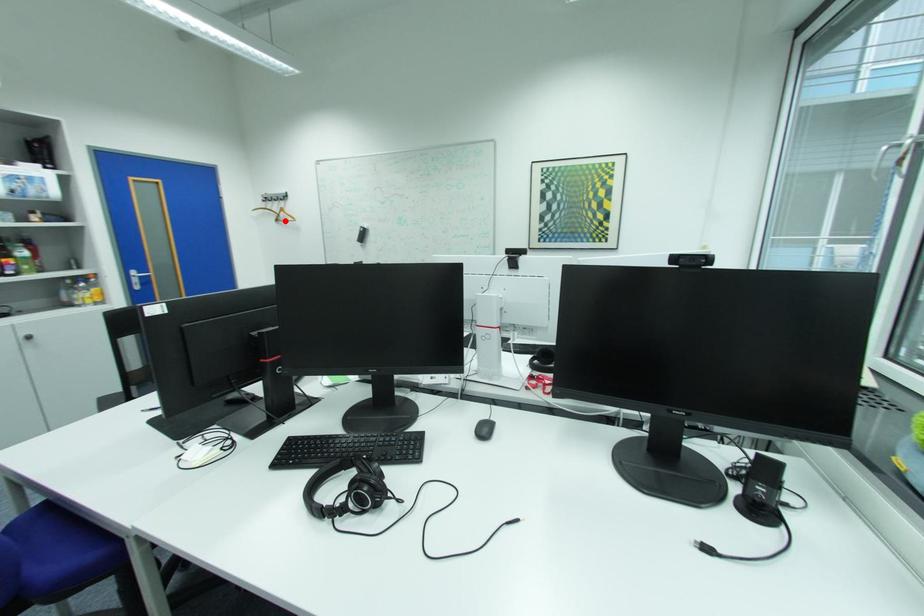
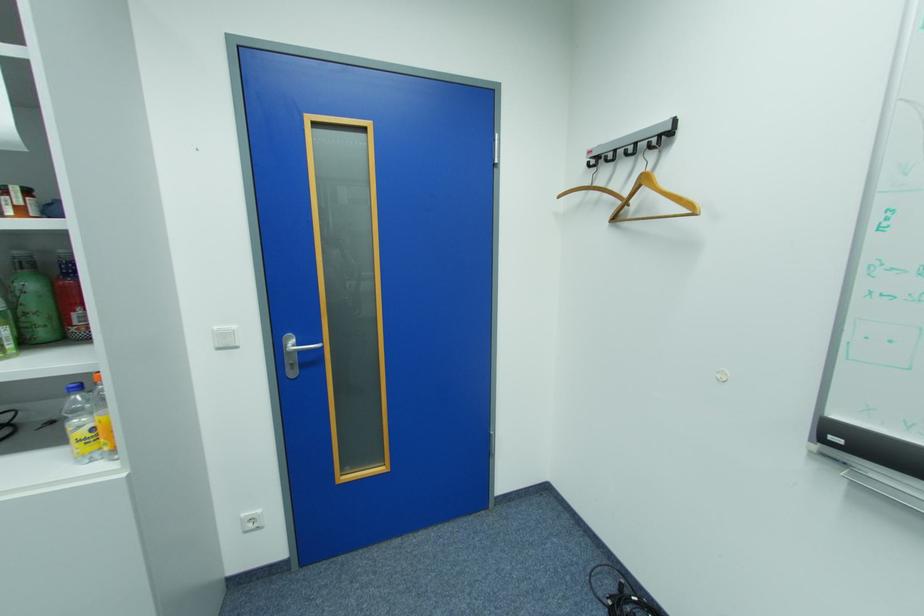
In the second image, find the point that corresponds to the highlighted location in the first image.

(624, 220)